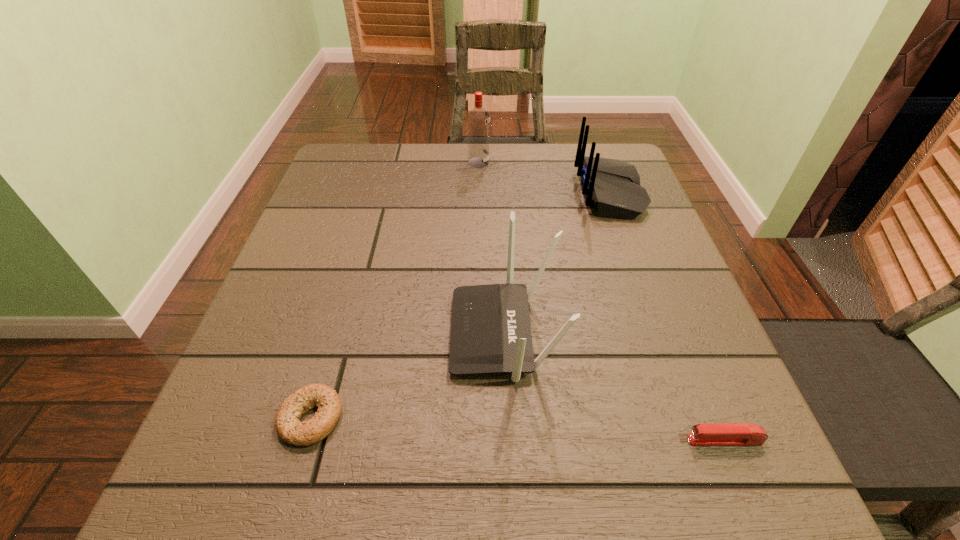
The width and height of the screenshot is (960, 540). In order to click on vodka in this screenshot , I will do `click(478, 119)`.

Where is `the left router`? the left router is located at coordinates (490, 326).

At what (x,y) coordinates should I click in order to perform the action: click on the farther router. Please return your answer as a coordinate pair (x, y). This screenshot has height=540, width=960. Looking at the image, I should click on (612, 186).

This screenshot has height=540, width=960. I want to click on the second shortest object, so click(727, 434).

Find the location of a particular element. The image size is (960, 540). the leftmost object is located at coordinates (289, 428).

Identify the location of the shortest object. The height and width of the screenshot is (540, 960). (289, 428).

Identify the location of free space located 0.300m on the front label of the vodka. Image resolution: width=960 pixels, height=540 pixels. (601, 163).

This screenshot has height=540, width=960. I want to click on free space located on the front-facing side of the left router, so click(344, 333).

Where is `free space located on the front-facing side of the left router`? free space located on the front-facing side of the left router is located at coordinates (259, 333).

Find the location of a particular element. This screenshot has height=540, width=960. vacant space located on the front-facing side of the left router is located at coordinates (304, 333).